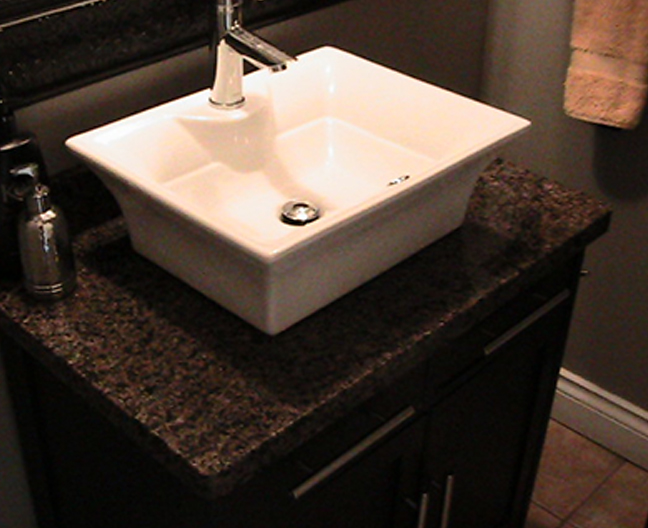
You are a GUI agent. You are given a task and a screenshot of the screen. Output one action in this format:
    pyautogui.click(x=<x>, y=<y>)
    Task: Click on the soap dispenser
    
    Given the screenshot: What is the action you would take?
    pyautogui.click(x=49, y=247)